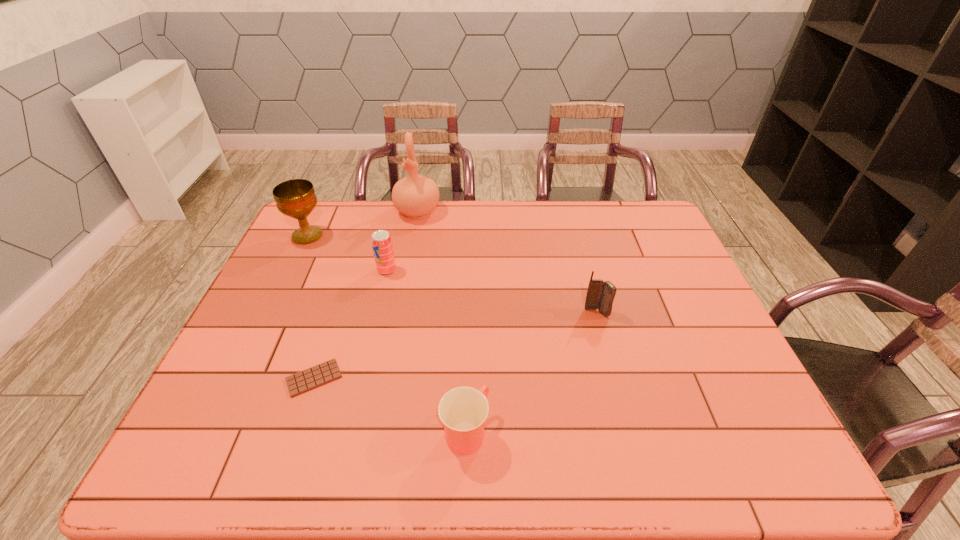
This screenshot has height=540, width=960. What are the coordinates of `object that is at the far left corner` in the screenshot? It's located at (296, 198).

I want to click on vacant space at the far edge, so click(x=531, y=228).

In the image, there is a desktop. Identify the location of free space at the near edge. (411, 438).

Locate an element on the screen. vacant space at the right edge is located at coordinates (653, 260).

Find the location of a particular element. free spot at the far left corner of the desktop is located at coordinates tap(327, 208).

Image resolution: width=960 pixels, height=540 pixels. What are the coordinates of `vacant space at the far right corner of the desktop` in the screenshot? It's located at (643, 202).

Locate an element on the screen. The image size is (960, 540). vacant area that lies between the shortest object and the pottery is located at coordinates (366, 295).

Image resolution: width=960 pixels, height=540 pixels. I want to click on empty location between the fifth shortest object and the fourth nearest object, so click(348, 253).

Locate an element on the screen. vacant area that lies between the rightmost object and the second shortest object is located at coordinates (531, 372).

Find the location of a particular element. The image size is (960, 540). empty space that is in between the fourth farthest object and the pottery is located at coordinates (507, 262).